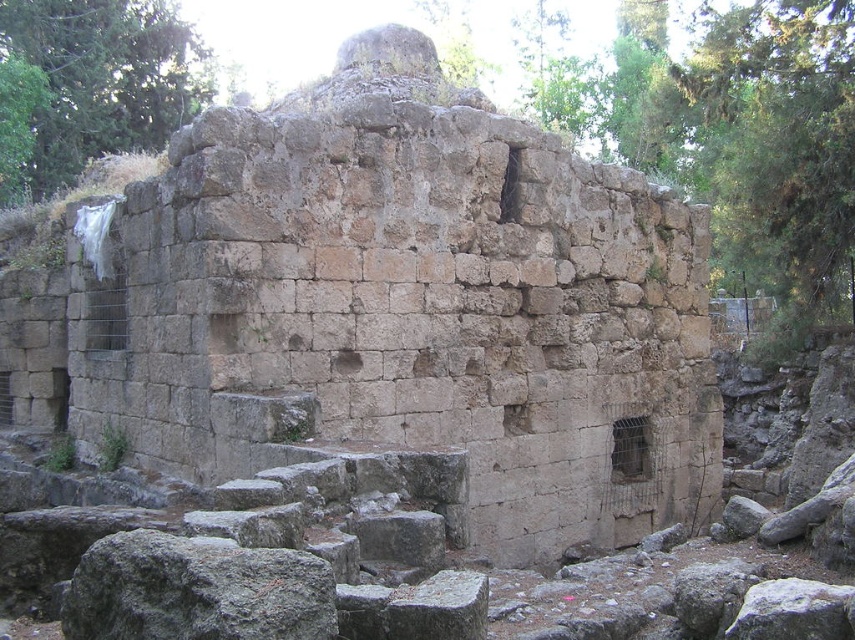
Question: Does rustic stone ruins at center come in front of gray rough rock at lower left?

Choices:
 (A) yes
 (B) no

Answer: (B)

Question: Which object is farther from the camera taking this photo?

Choices:
 (A) gray rough rock at lower left
 (B) rustic stone ruins at center

Answer: (B)

Question: Which of the following is the farthest from the observer?

Choices:
 (A) gray rough rock at lower left
 (B) rustic stone ruins at center

Answer: (B)

Question: In this image, where is rustic stone ruins at center located relative to gray rough rock at lower left?

Choices:
 (A) right
 (B) left

Answer: (A)

Question: Which object appears closest to the camera in this image?

Choices:
 (A) rustic stone ruins at center
 (B) gray rough rock at lower left

Answer: (B)

Question: Is rustic stone ruins at center smaller than gray rough rock at lower left?

Choices:
 (A) yes
 (B) no

Answer: (B)